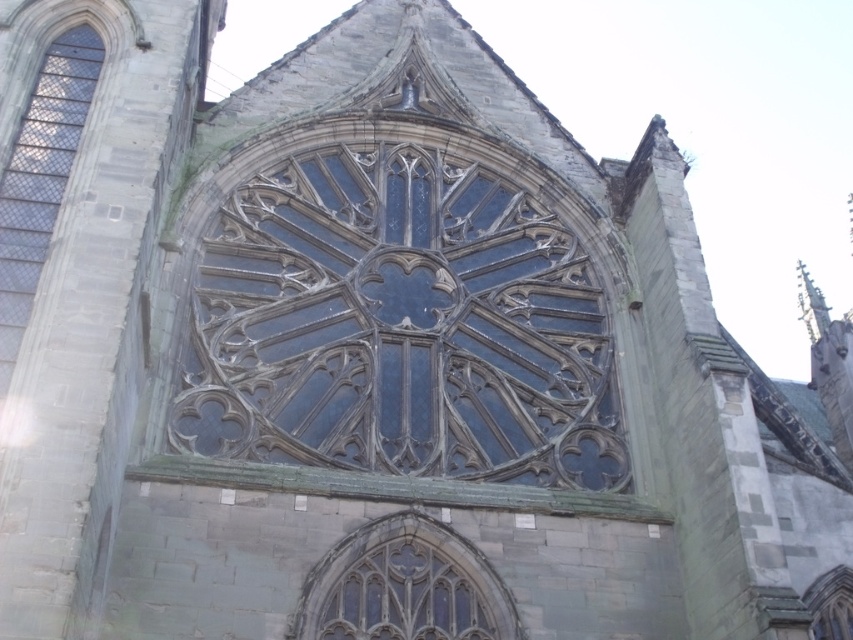
You are an architect examining the Gothic building. You notice the dark glass window at left and the clear glass window at center. Which one is taller?

The dark glass window at left is taller than the clear glass window at center.

You are an architect examining the Gothic building. You notice two windows in the image. Which one is positioned higher up, the dark glass window at center or the clear glass window at center?

The dark glass window at center is located above the clear glass window at center, so it is positioned higher up.